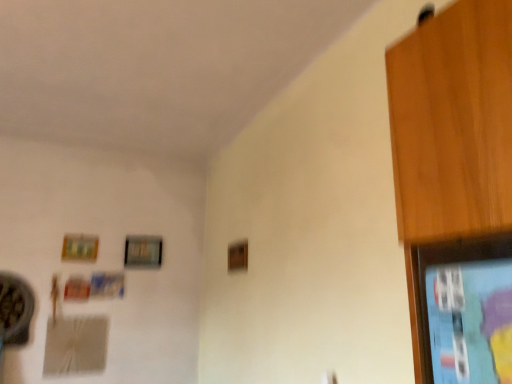
Question: Is wooden picture frame at upper center, the 2th picture frame in the left-to-right sequence, to the left or to the right of wooden picture frame at upper left, acting as the 2th picture frame starting from the right, in the image?

Choices:
 (A) right
 (B) left

Answer: (A)

Question: In the image, is wooden picture frame at upper center, which is the second picture frame in front-to-back order, positioned in front of or behind wooden picture frame at upper left, which is the first picture frame from front to back?

Choices:
 (A) front
 (B) behind

Answer: (B)

Question: Is wooden picture frame at upper center, arranged as the 1th picture frame when viewed from the back, spatially inside wooden picture frame at upper left, which is the first picture frame from front to back, or outside of it?

Choices:
 (A) outside
 (B) inside

Answer: (A)

Question: Is wooden picture frame at upper left, which is the 1th picture frame from left to right, in front of or behind wooden picture frame at upper center, the 1th picture frame in the right-to-left sequence, in the image?

Choices:
 (A) front
 (B) behind

Answer: (A)

Question: Is point (67, 258) closer or farther from the camera than point (138, 241)?

Choices:
 (A) farther
 (B) closer

Answer: (B)

Question: Is wooden picture frame at upper left, which is the 1th picture frame from left to right, inside the boundaries of wooden picture frame at upper center, which is the second picture frame in front-to-back order, or outside?

Choices:
 (A) outside
 (B) inside

Answer: (A)

Question: Is wooden picture frame at upper left, which is the 1th picture frame from left to right, taller or shorter than wooden picture frame at upper center, which is the second picture frame in front-to-back order?

Choices:
 (A) short
 (B) tall

Answer: (A)